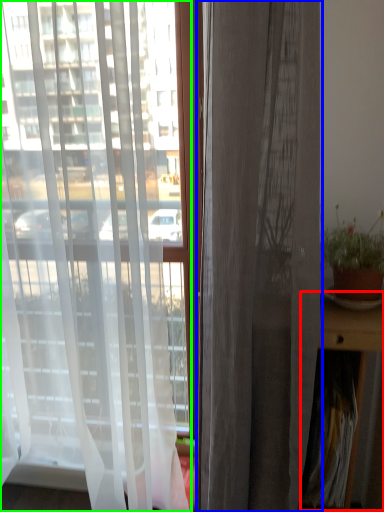
Question: Considering the real-world distances, which object is farthest from table (highlighted by a red box)? curtain (highlighted by a blue box) or curtain (highlighted by a green box)?

Choices:
 (A) curtain
 (B) curtain

Answer: (B)